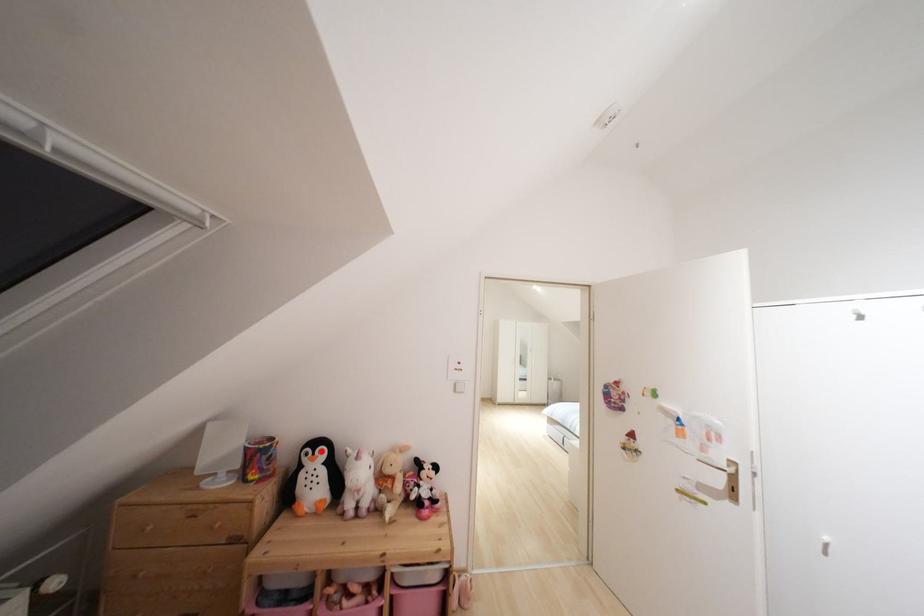
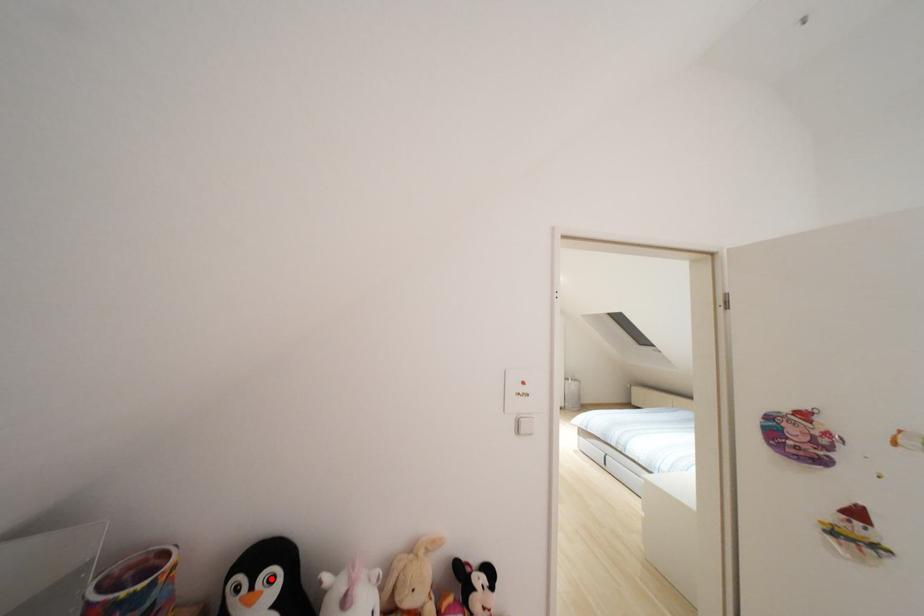
I am providing you with two images of the same scene from different viewpoints. A red point is marked on the first image and another point is marked on the second image. Do the highlighted points in image1 and image2 indicate the same real-world spot?

Yes